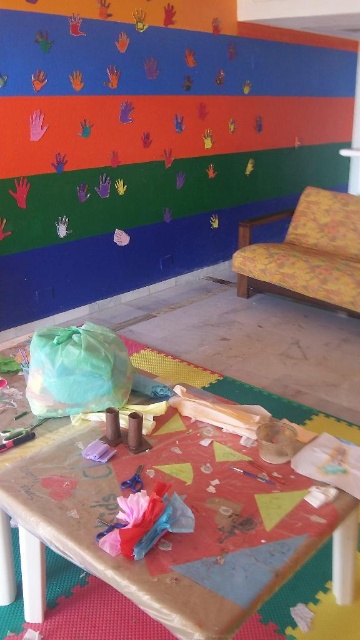
You are an interior designer looking to place a new decorative item on the table. You have a small sculpture that needs to be placed either on the wrinkled brown paper at center or the yellow floral fabric sofa at right. Based on their positions, where would you place it to ensure it is visible from the entrance of the room?

The wrinkled brown paper at center is located below the yellow floral fabric sofa at right, so placing the sculpture on the yellow floral fabric sofa at right would make it more visible from the entrance as it is higher up.

You are organizing an art exhibit and need to place the wrinkled brown paper at center and the yellow floral fabric sofa at right in a gallery. Based on their sizes, which object should be placed closer to the entrance to ensure there is enough space for visitors to walk around?

The wrinkled brown paper at center might be wider than the yellow floral fabric sofa at right, so placing the sofa closer to the entrance would leave more space for visitors to navigate around the wider paper.